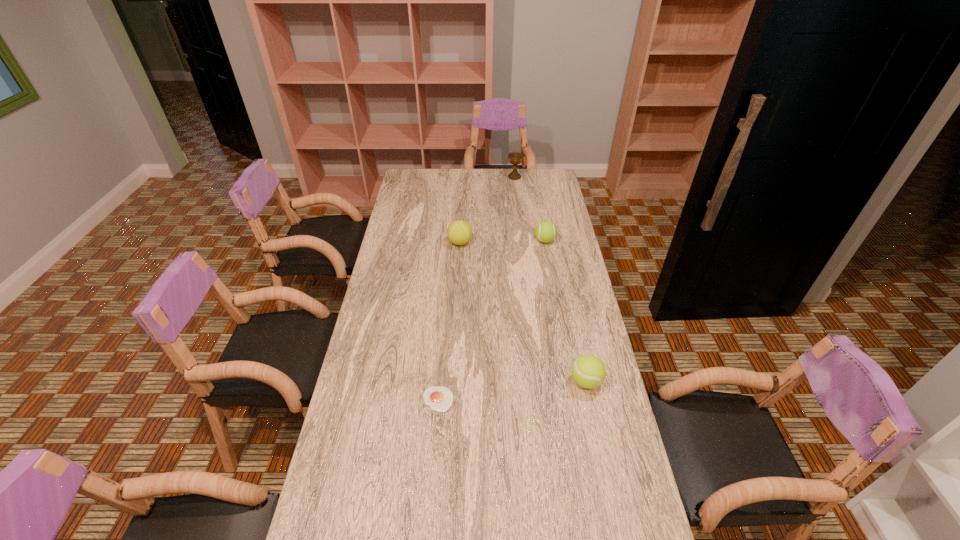
Where is `free region at the left edge of the desktop`? The height and width of the screenshot is (540, 960). free region at the left edge of the desktop is located at coordinates (368, 338).

The width and height of the screenshot is (960, 540). In the image, there is a desktop. Identify the location of vacant space at the right edge. (635, 482).

I want to click on vacant space at the far right corner of the desktop, so click(546, 174).

Where is `free space between the nearest tennis ball and the shortest object`? This screenshot has width=960, height=540. free space between the nearest tennis ball and the shortest object is located at coordinates (512, 390).

The width and height of the screenshot is (960, 540). Identify the location of unoccupied area between the shortest object and the leftmost tennis ball. (449, 321).

Locate an element on the screen. This screenshot has height=540, width=960. unoccupied position between the nearest tennis ball and the egg yolk is located at coordinates (512, 390).

The image size is (960, 540). Find the location of `vacant space in between the leftmost tennis ball and the shortest object`. vacant space in between the leftmost tennis ball and the shortest object is located at coordinates (449, 321).

Image resolution: width=960 pixels, height=540 pixels. What are the coordinates of `free space between the farthest object and the shortest object` in the screenshot? It's located at (476, 288).

Find the location of `free space between the nearest tennis ball and the leftmost tennis ball`. free space between the nearest tennis ball and the leftmost tennis ball is located at coordinates (523, 312).

The height and width of the screenshot is (540, 960). What are the coordinates of `free space between the farthest object and the leftmost tennis ball` in the screenshot? It's located at (488, 210).